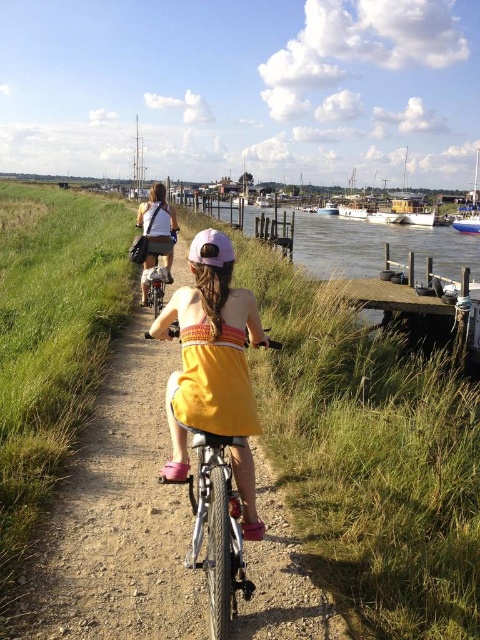
Does point (394, 568) come in front of point (195, 237)?

That is True.

Can you confirm if green grass at center is positioned to the right of purple matte bicycle helmet at center?

No, green grass at center is not to the right of purple matte bicycle helmet at center.

Is point (52, 328) less distant than point (213, 237)?

That is False.

I want to click on green grass at center, so tap(371, 458).

Is orange cotton dress at center to the left of white wooden boat at right from the viewer's perspective?

Indeed, orange cotton dress at center is positioned on the left side of white wooden boat at right.

Can you confirm if orange cotton dress at center is shorter than white wooden boat at right?

Indeed, orange cotton dress at center has a lesser height compared to white wooden boat at right.

Is point (179, 420) behind point (477, 172)?

No, it is in front of (477, 172).

Identify the location of orange cotton dress at center. The height and width of the screenshot is (640, 480). (215, 381).

How far apart are green grass at left and purple matte bicycle helmet at center?

green grass at left is 7.44 meters away from purple matte bicycle helmet at center.

Between point (87, 196) and point (219, 248), which one is positioned in front?

Positioned in front is point (219, 248).

This screenshot has height=640, width=480. In order to click on green grass at left in this screenshot , I will do `click(51, 346)`.